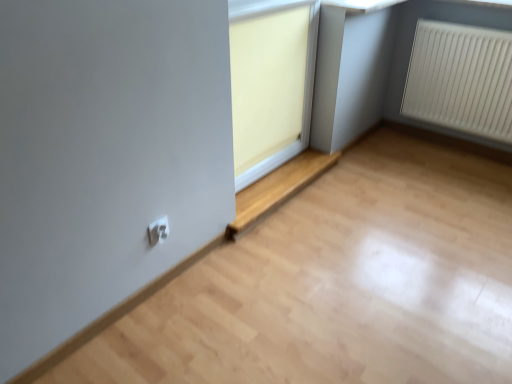
Question: In terms of width, does white plastic radiator at right look wider or thinner when compared to matte wood window at center?

Choices:
 (A) wide
 (B) thin

Answer: (B)

Question: Is point click(x=448, y=119) closer or farther from the camera than point click(x=268, y=180)?

Choices:
 (A) closer
 (B) farther

Answer: (B)

Question: Which of these objects is positioned farthest from the white plastic electric outlet at lower center?

Choices:
 (A) matte wood window at center
 (B) white plastic radiator at right
 (C) white plastic window frame at upper center

Answer: (B)

Question: Which object is the farthest from the white plastic radiator at right?

Choices:
 (A) white plastic electric outlet at lower center
 (B) white plastic window frame at upper center
 (C) matte wood window at center

Answer: (A)